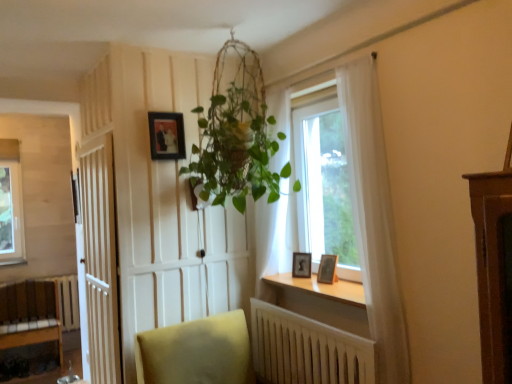
Question: In which direction should I rotate to look at wooden photo frame at window, marked as the third picture frame in a left-to-right arrangement?

Choices:
 (A) right
 (B) left

Answer: (A)

Question: Considering the relative sizes of wooden photo frame at window, the second picture frame positioned from the top, and wooden photo frame at window sill, which appears as the 1th picture frame when ordered from the bottom, in the image provided, is wooden photo frame at window, the second picture frame positioned from the top, thinner than wooden photo frame at window sill, which appears as the 1th picture frame when ordered from the bottom,?

Choices:
 (A) no
 (B) yes

Answer: (A)

Question: From a real-world perspective, is wooden photo frame at window, which is counted as the first picture frame, starting from the right, beneath wooden photo frame at window sill, the second picture frame viewed from the left?

Choices:
 (A) yes
 (B) no

Answer: (B)

Question: Can you confirm if wooden photo frame at window, which is counted as the first picture frame, starting from the right, is wider than wooden photo frame at window sill, which appears as the 1th picture frame when ordered from the bottom?

Choices:
 (A) yes
 (B) no

Answer: (A)

Question: From the image's perspective, would you say wooden photo frame at window, the second picture frame positioned from the top, is positioned over wooden photo frame at window sill, which ranks as the 2th picture frame in right-to-left order?

Choices:
 (A) no
 (B) yes

Answer: (B)

Question: Is wooden photo frame at window, which is counted as the first picture frame, starting from the right, taller than wooden photo frame at window sill, the second picture frame viewed from the left?

Choices:
 (A) yes
 (B) no

Answer: (A)

Question: Are wooden photo frame at window, the second picture frame positioned from the top, and wooden photo frame at window sill, which ranks as the 2th picture frame in right-to-left order, located far from each other?

Choices:
 (A) yes
 (B) no

Answer: (B)

Question: Does wooden at lower center contain wooden photo frame at window, marked as the third picture frame in a left-to-right arrangement?

Choices:
 (A) yes
 (B) no

Answer: (B)

Question: Considering the relative sizes of wooden at lower center and wooden photo frame at window, the second picture frame positioned from the bottom, in the image provided, is wooden at lower center smaller than wooden photo frame at window, the second picture frame positioned from the bottom,?

Choices:
 (A) yes
 (B) no

Answer: (B)

Question: From a real-world perspective, is wooden at lower center on wooden photo frame at window, the second picture frame positioned from the bottom?

Choices:
 (A) no
 (B) yes

Answer: (A)

Question: Is wooden at lower center to the right of wooden photo frame at window, which is counted as the first picture frame, starting from the right, from the viewer's perspective?

Choices:
 (A) yes
 (B) no

Answer: (B)

Question: Can you confirm if wooden at lower center is wider than wooden photo frame at window, which is counted as the first picture frame, starting from the right?

Choices:
 (A) yes
 (B) no

Answer: (A)

Question: Considering the relative sizes of wooden at lower center and wooden photo frame at window, the second picture frame positioned from the top, in the image provided, is wooden at lower center shorter than wooden photo frame at window, the second picture frame positioned from the top,?

Choices:
 (A) no
 (B) yes

Answer: (B)

Question: Is white wooden door at left facing away from matte black frame at upper center, arranged as the first picture frame when viewed from the left?

Choices:
 (A) no
 (B) yes

Answer: (A)